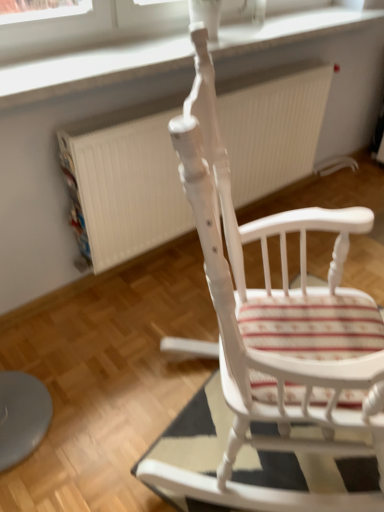
Question: From a real-world perspective, is white painted wood rocking chair at center located higher than white textured radiator at center?

Choices:
 (A) yes
 (B) no

Answer: (A)

Question: From the image's perspective, does white painted wood rocking chair at center appear higher than white textured radiator at center?

Choices:
 (A) yes
 (B) no

Answer: (B)

Question: Is white painted wood rocking chair at center next to white textured radiator at center and touching it?

Choices:
 (A) yes
 (B) no

Answer: (B)

Question: Would you say white painted wood rocking chair at center is outside white textured radiator at center?

Choices:
 (A) no
 (B) yes

Answer: (B)

Question: Does white painted wood rocking chair at center have a lesser height compared to white textured radiator at center?

Choices:
 (A) yes
 (B) no

Answer: (B)

Question: From a real-world perspective, does white painted wood rocking chair at center sit lower than white textured radiator at center?

Choices:
 (A) no
 (B) yes

Answer: (A)

Question: Considering the relative sizes of striped fabric mat at center and white painted wood rocking chair at center in the image provided, is striped fabric mat at center shorter than white painted wood rocking chair at center?

Choices:
 (A) no
 (B) yes

Answer: (B)

Question: From the image's perspective, is striped fabric mat at center located beneath white painted wood rocking chair at center?

Choices:
 (A) no
 (B) yes

Answer: (B)

Question: Is striped fabric mat at center outside white painted wood rocking chair at center?

Choices:
 (A) no
 (B) yes

Answer: (B)

Question: Considering the relative sizes of striped fabric mat at center and white painted wood rocking chair at center in the image provided, is striped fabric mat at center thinner than white painted wood rocking chair at center?

Choices:
 (A) yes
 (B) no

Answer: (A)

Question: Is white painted wood rocking chair at center inside striped fabric mat at center?

Choices:
 (A) yes
 (B) no

Answer: (B)

Question: Considering the relative positions of striped fabric mat at center and white painted wood rocking chair at center in the image provided, is striped fabric mat at center to the left of white painted wood rocking chair at center from the viewer's perspective?

Choices:
 (A) yes
 (B) no

Answer: (B)

Question: Is white plastic window frame at upper center completely or partially outside of white painted wood rocking chair at center?

Choices:
 (A) yes
 (B) no

Answer: (A)